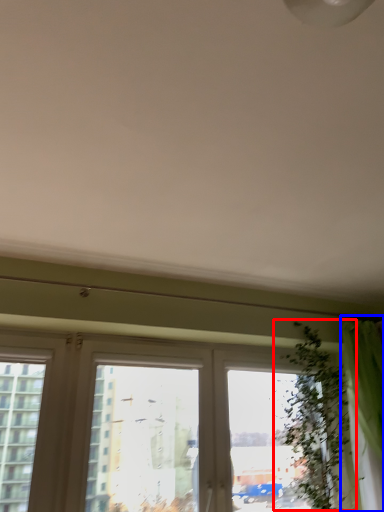
Question: Which point is closer to the camera, vegetation (highlighted by a red box) or curtain (highlighted by a blue box)?

Choices:
 (A) vegetation
 (B) curtain

Answer: (B)